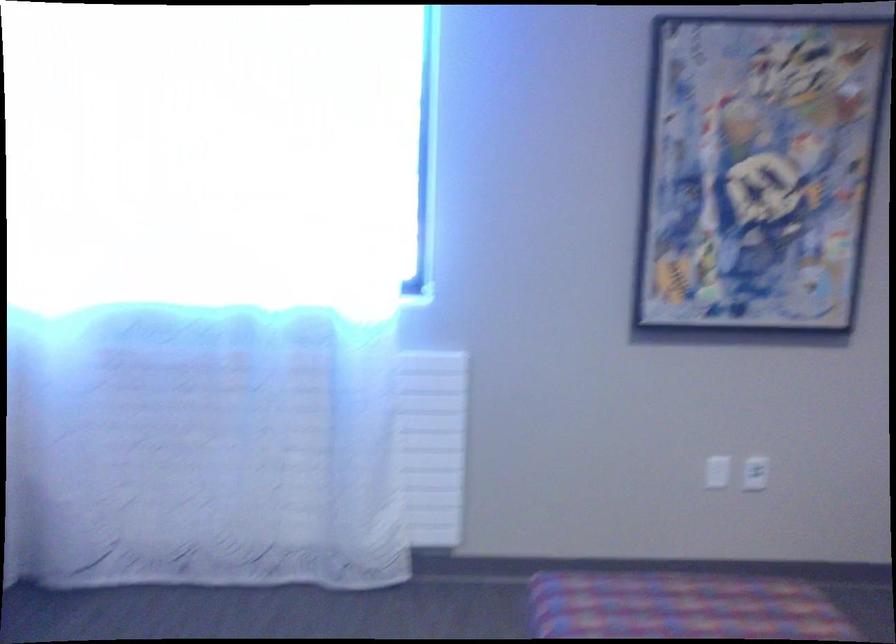
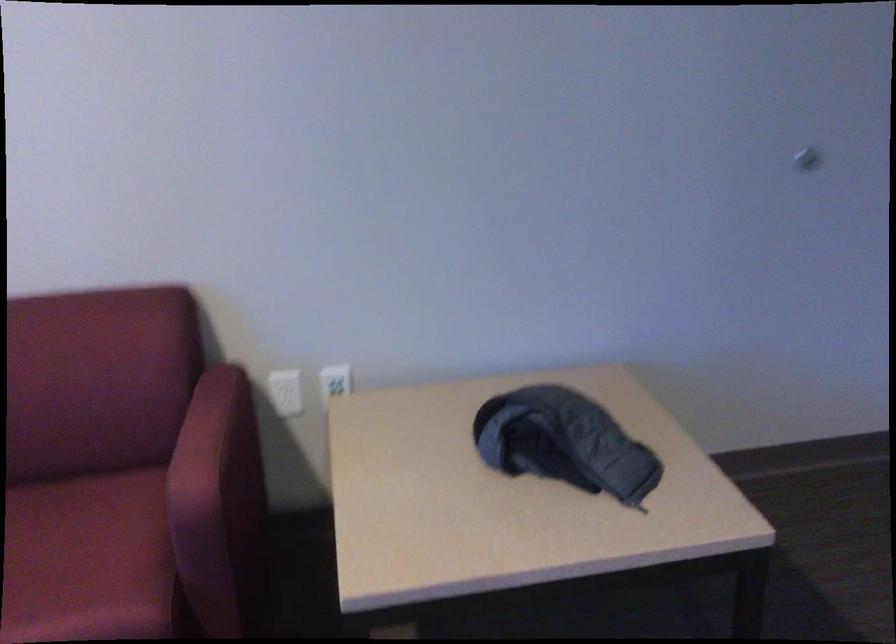
How did the camera likely rotate?

The camera's rotation is toward right-down.